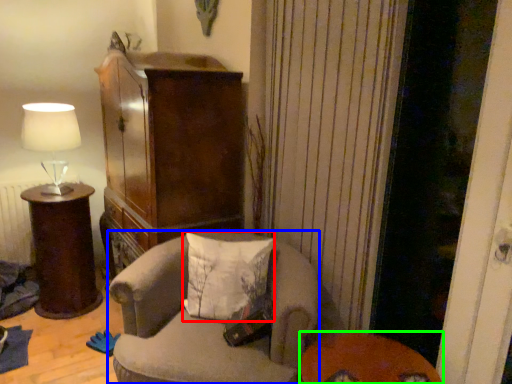
Question: Considering the real-world distances, which object is farthest from pillow (highlighted by a red box)? chair (highlighted by a blue box) or table (highlighted by a green box)?

Choices:
 (A) chair
 (B) table

Answer: (B)